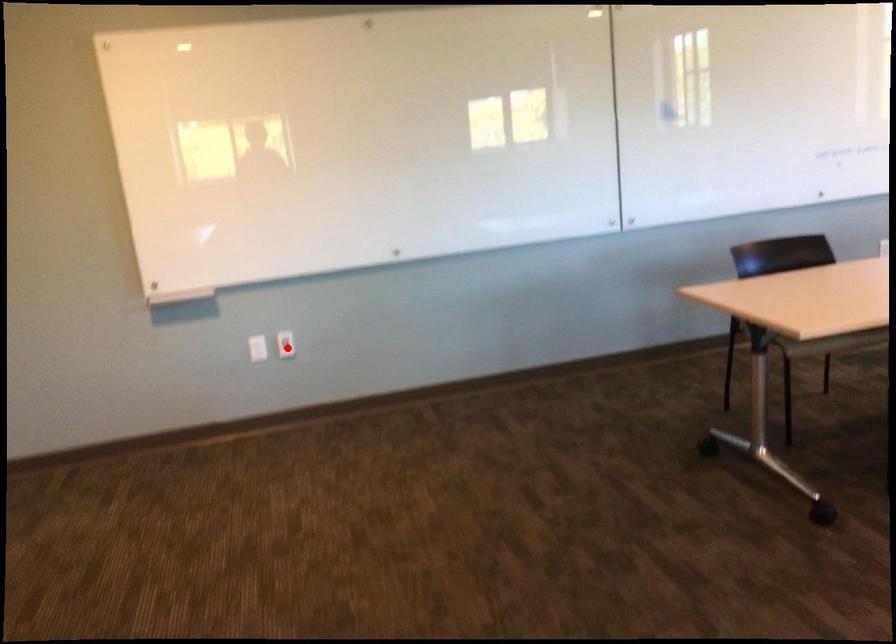
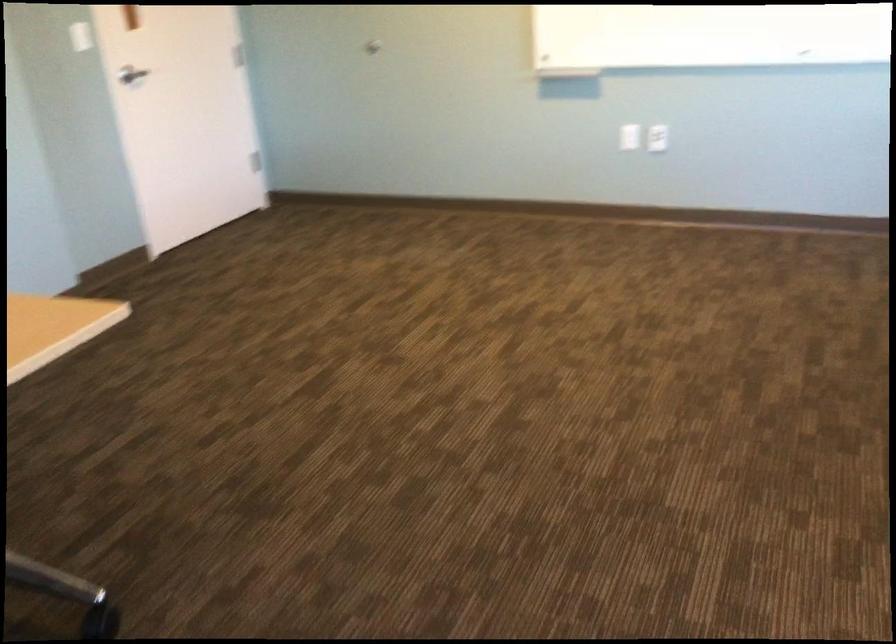
Where in the second image is the point corresponding to the highlighted location from the first image?

(657, 138)